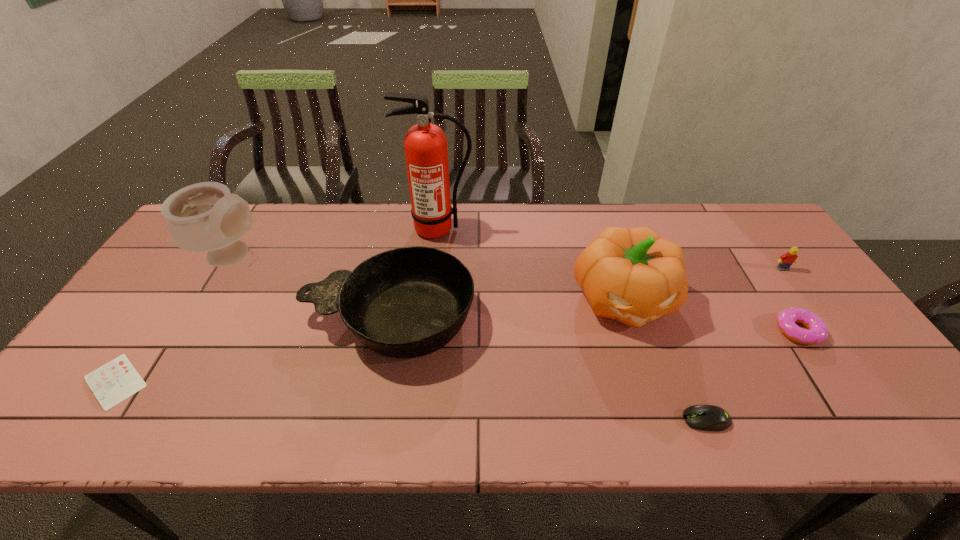
Where is `vacant space located on the carved face of the third tallest object`? The height and width of the screenshot is (540, 960). vacant space located on the carved face of the third tallest object is located at coordinates (658, 405).

Where is `vacant space located with the handle extending from the side of the fifth shortest object`? vacant space located with the handle extending from the side of the fifth shortest object is located at coordinates pos(181,319).

Where is `vacant region located 0.370m with the handle extending from the side of the fifth shortest object`? Image resolution: width=960 pixels, height=540 pixels. vacant region located 0.370m with the handle extending from the side of the fifth shortest object is located at coordinates (163, 319).

Locate an element on the screen. The image size is (960, 540). free spot located with the handle extending from the side of the fifth shortest object is located at coordinates (178, 319).

Locate an element on the screen. This screenshot has width=960, height=540. free location located on the front-facing side of the fifth tallest object is located at coordinates (854, 368).

You are a GUI agent. You are given a task and a screenshot of the screen. Output one action in this format:
    pyautogui.click(x=<x>, y=<y>)
    Task: Click on the blank area located on the left of the sixth tallest object
    The height and width of the screenshot is (540, 960).
    Given the screenshot: What is the action you would take?
    pyautogui.click(x=624, y=330)

Identify the location of vacant region located 0.250m on the wheel side of the second shortest object. The width and height of the screenshot is (960, 540). (567, 420).

Image resolution: width=960 pixels, height=540 pixels. I want to click on vacant space located on the wheel side of the second shortest object, so click(581, 420).

Locate an element on the screen. vacant space located on the wheel side of the second shortest object is located at coordinates tap(636, 420).

Where is `vacant space situated 0.230m on the right of the diary`? vacant space situated 0.230m on the right of the diary is located at coordinates (249, 381).